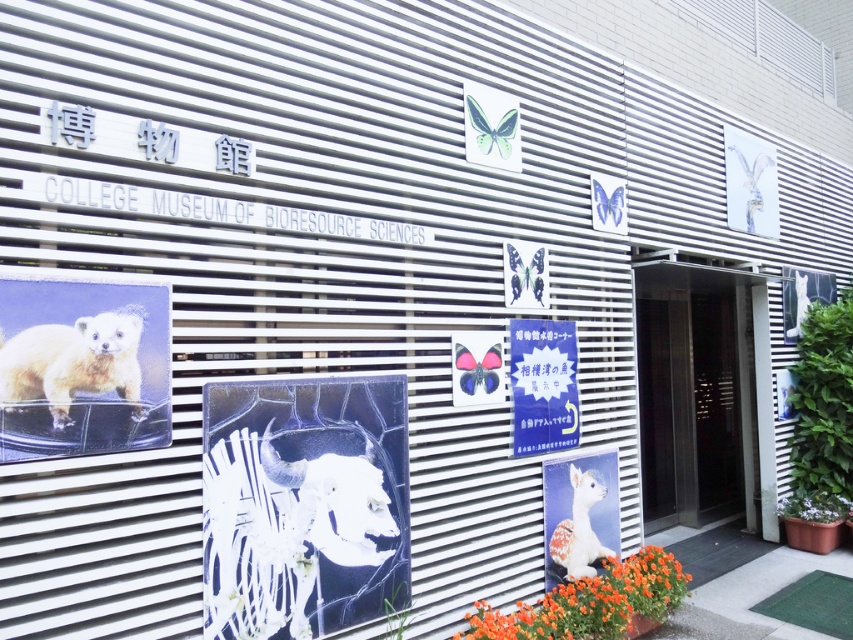
Question: In this image, where is fuzzy yellow fur at left located relative to blue paper sign at center?

Choices:
 (A) right
 (B) left

Answer: (B)

Question: Which point appears closest to the camera in this image?

Choices:
 (A) click(x=647, y=310)
 (B) click(x=575, y=477)

Answer: (B)

Question: Which of the following is the closest to the observer?

Choices:
 (A) orange matte flower at lower center
 (B) white woolen alpaca at lower center
 (C) metallic silver elevator at center

Answer: (A)

Question: Does fuzzy yellow fur at left appear over white woolen alpaca at lower center?

Choices:
 (A) yes
 (B) no

Answer: (A)

Question: Can you confirm if metallic silver elevator at center is bigger than fuzzy yellow fur at left?

Choices:
 (A) yes
 (B) no

Answer: (A)

Question: Which of the following is the farthest from the observer?

Choices:
 (A) (589, 506)
 (B) (642, 460)
 (C) (521, 612)

Answer: (B)